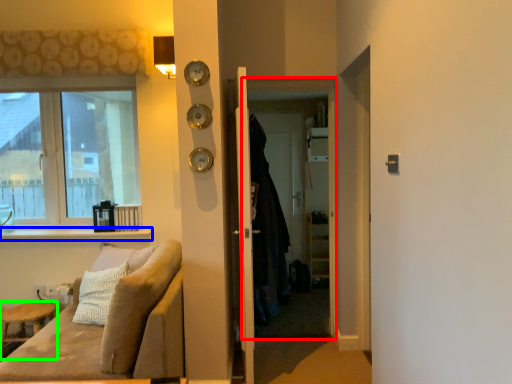
Question: Which is nearer to the screen door (highlighted by a red box)? window sill (highlighted by a blue box) or furniture (highlighted by a green box).

Choices:
 (A) window sill
 (B) furniture

Answer: (A)